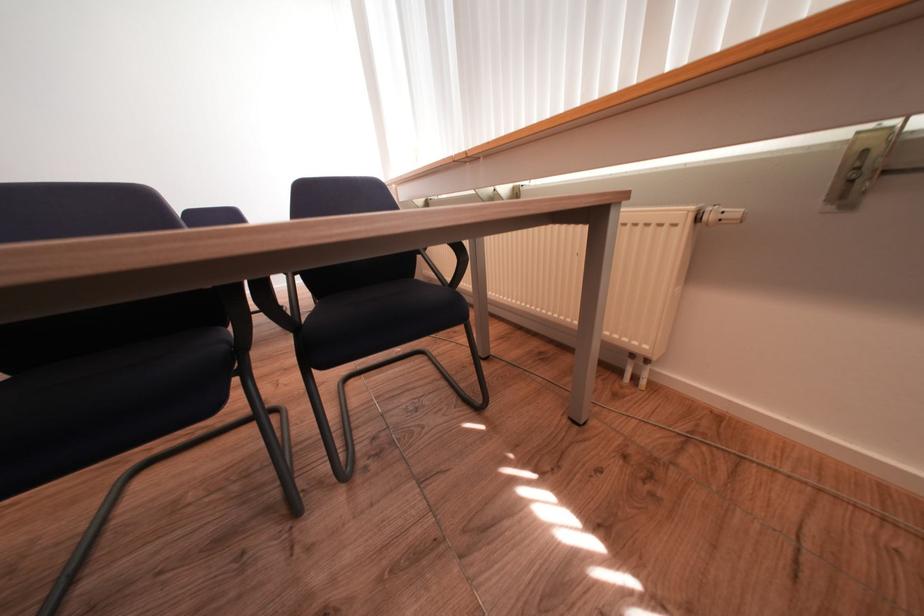
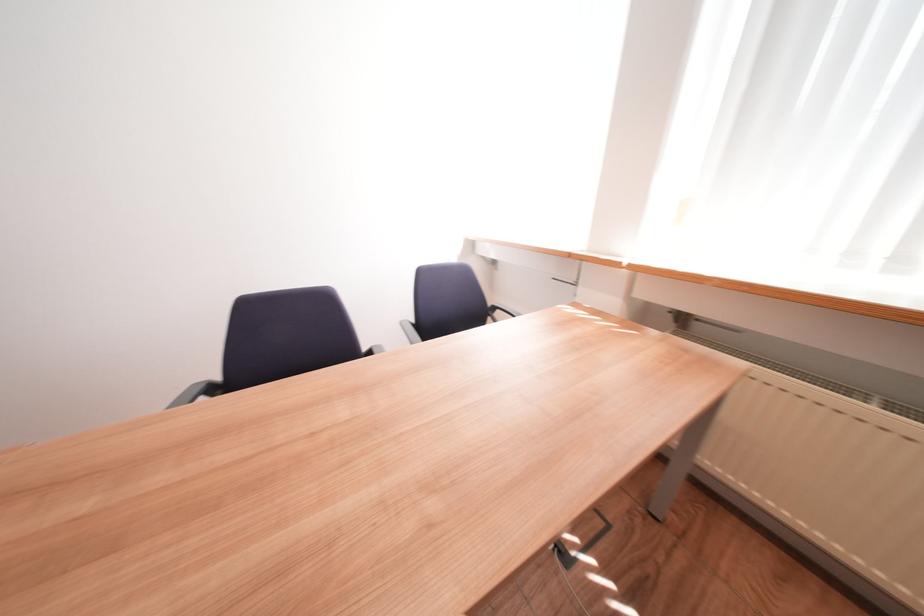
Which direction would the cameraman need to move to produce the second image?

The cameraman moved toward left, forward.